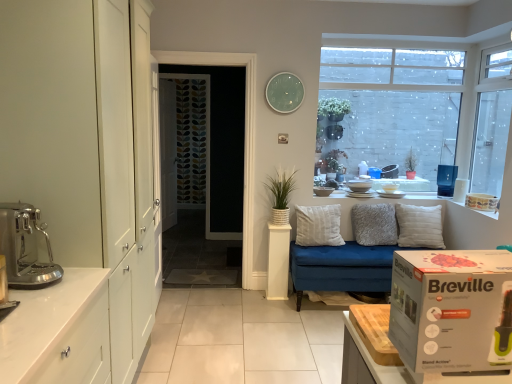
I want to click on blank space situated above grey fluffy pillow at center, acting as the 2th pillow starting from the right (from a real-world perspective), so click(x=373, y=199).